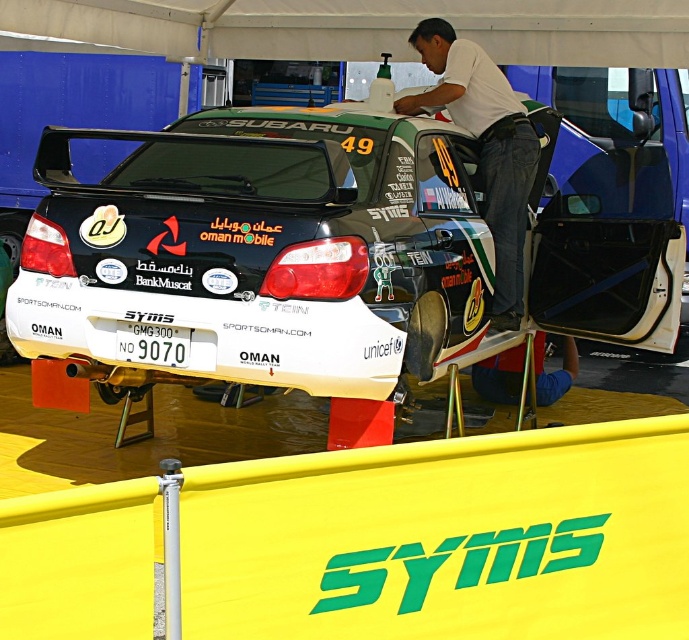
You are a photographer trying to capture a closeup of the white plastic license plate at center. The white glossy rally car at center is blocking your view. Can you estimate if the license plate is wider than the car?

The white glossy rally car at center might be wider than white plastic license plate at center, so it is possible that the car is blocking the license plate completely or partially, making it difficult to capture a clear closeup.

You are a photographer taking a picture of the white glossy rally car at center and the white cotton shirt at upper center. Which object should you focus on first if you want to capture both in the same frame without moving the camera?

The white glossy rally car at center is to the left of the white cotton shirt at upper center, so you should focus on the white glossy rally car at center first to ensure both are in the frame without moving the camera.